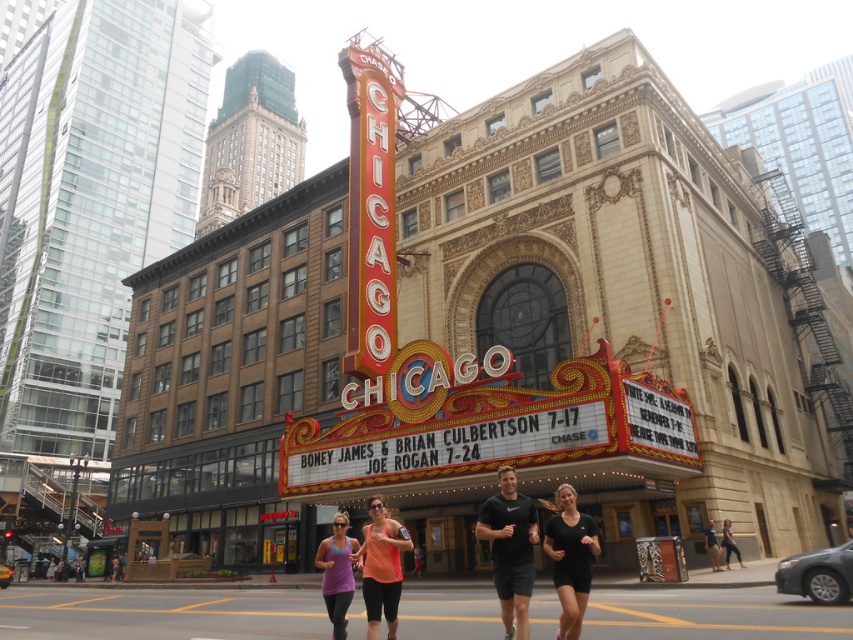
Question: Estimate the real-world distances between objects in this image. Which object is farther from the matte orange shirt at center?

Choices:
 (A) black athletic shorts at center
 (B) black matte shorts at lower right
 (C) black matte shirt at center

Answer: (A)

Question: Considering the relative positions of purple fabric tank top at lower center and black fabric pants at lower right in the image provided, where is purple fabric tank top at lower center located with respect to black fabric pants at lower right?

Choices:
 (A) above
 (B) below

Answer: (A)

Question: Which of the following is the closest to the observer?

Choices:
 (A) (375, 529)
 (B) (733, 545)

Answer: (A)

Question: Which point is closer to the camera taking this photo?

Choices:
 (A) (578, 609)
 (B) (737, 548)
 (C) (498, 563)

Answer: (A)

Question: Can you confirm if purple fabric tank top at lower center is bigger than black athletic shorts at center?

Choices:
 (A) yes
 (B) no

Answer: (A)

Question: Is black matte shirt at center to the left of black fabric pants at lower right from the viewer's perspective?

Choices:
 (A) no
 (B) yes

Answer: (B)